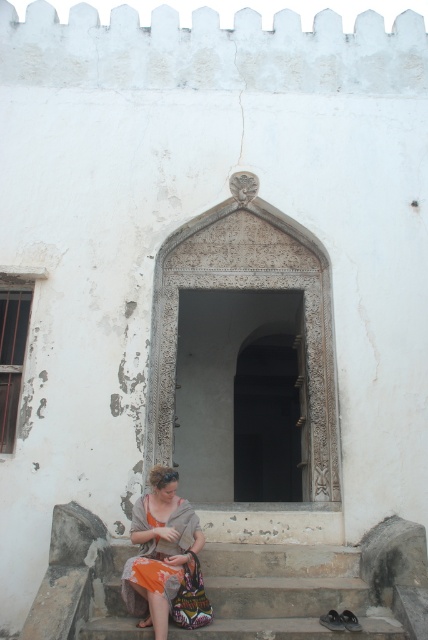
Question: Is smooth stone stairs at lower center to the left of orange fabric at lower left from the viewer's perspective?

Choices:
 (A) no
 (B) yes

Answer: (A)

Question: Is smooth stone stairs at lower center bigger than orange fabric at lower left?

Choices:
 (A) no
 (B) yes

Answer: (A)

Question: Is smooth stone stairs at lower center below orange fabric at lower left?

Choices:
 (A) yes
 (B) no

Answer: (A)

Question: Among these points, which one is nearest to the camera?

Choices:
 (A) (220, 577)
 (B) (125, 588)

Answer: (B)